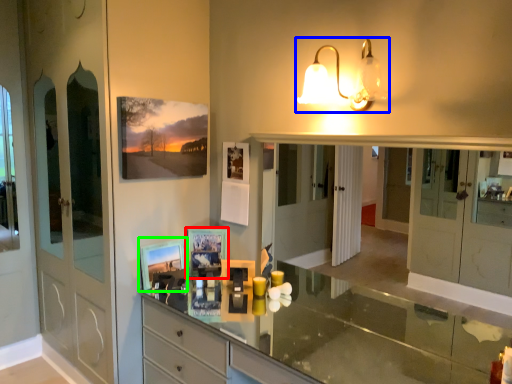
Question: Which is farther away from picture frame (highlighted by a red box)? lamp (highlighted by a blue box) or picture frame (highlighted by a green box)?

Choices:
 (A) lamp
 (B) picture frame

Answer: (A)